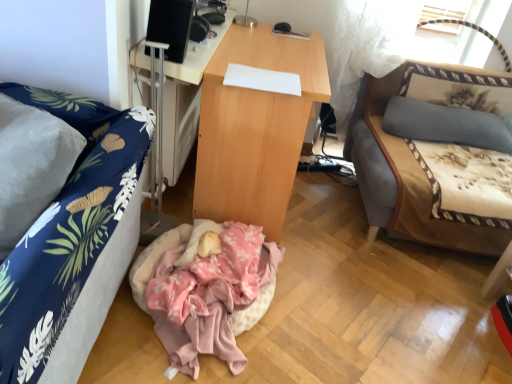
Question: From the image's perspective, is black matte speaker at upper center located above or below wooden desk at center, the 2th desk in the right-to-left sequence?

Choices:
 (A) below
 (B) above

Answer: (B)

Question: Would you say black matte speaker at upper center is to the left or to the right of wooden desk at center, the 2th desk in the right-to-left sequence, in the picture?

Choices:
 (A) left
 (B) right

Answer: (B)

Question: Which is nearer to the gray fabric pillow at right?

Choices:
 (A) beige fabric studio couch at right, which is counted as the 2th studio couch, starting from the front
 (B) pink fabric infant bed at center
 (C) white sheer curtain at upper right
 (D) blue fabric couch at left, which is the 2th studio couch from back to front
 (E) black matte speaker at upper center

Answer: (A)

Question: Which is nearer to the blue fabric couch at left, the 2th studio couch positioned from the right?

Choices:
 (A) beige fabric studio couch at right, the 2th studio couch viewed from the left
 (B) black matte speaker at upper center
 (C) pink fabric infant bed at center
 (D) white sheer curtain at upper right
 (E) wooden desk at center, arranged as the 1th desk when viewed from the left

Answer: (E)